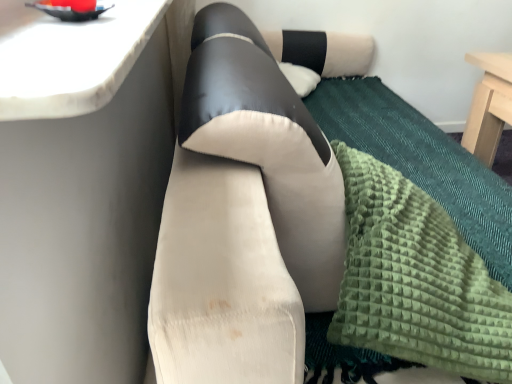
Question: Is suede-like beige couch at center shorter than green textured blanket at lower right?

Choices:
 (A) no
 (B) yes

Answer: (A)

Question: Is suede-like beige couch at center closer to the viewer compared to green textured blanket at lower right?

Choices:
 (A) yes
 (B) no

Answer: (A)

Question: Considering the relative sizes of suede-like beige couch at center and green textured blanket at lower right in the image provided, is suede-like beige couch at center taller than green textured blanket at lower right?

Choices:
 (A) no
 (B) yes

Answer: (B)

Question: From the image's perspective, is suede-like beige couch at center over green textured blanket at lower right?

Choices:
 (A) yes
 (B) no

Answer: (A)

Question: Would you say suede-like beige couch at center contains green textured blanket at lower right?

Choices:
 (A) no
 (B) yes

Answer: (B)

Question: Is suede-like beige couch at center smaller than green textured blanket at lower right?

Choices:
 (A) yes
 (B) no

Answer: (B)

Question: Can you confirm if white marble countertop at upper left is thinner than green textured blanket at lower right?

Choices:
 (A) no
 (B) yes

Answer: (B)

Question: Is white marble countertop at upper left wider than green textured blanket at lower right?

Choices:
 (A) yes
 (B) no

Answer: (B)

Question: Is white marble countertop at upper left directly adjacent to green textured blanket at lower right?

Choices:
 (A) no
 (B) yes

Answer: (A)

Question: Can you confirm if white marble countertop at upper left is smaller than green textured blanket at lower right?

Choices:
 (A) no
 (B) yes

Answer: (B)

Question: From the image's perspective, does white marble countertop at upper left appear lower than green textured blanket at lower right?

Choices:
 (A) yes
 (B) no

Answer: (B)

Question: Is white marble countertop at upper left bigger than green textured blanket at lower right?

Choices:
 (A) yes
 (B) no

Answer: (B)

Question: Considering the relative sizes of suede-like beige couch at center and white marble countertop at upper left in the image provided, is suede-like beige couch at center smaller than white marble countertop at upper left?

Choices:
 (A) yes
 (B) no

Answer: (B)